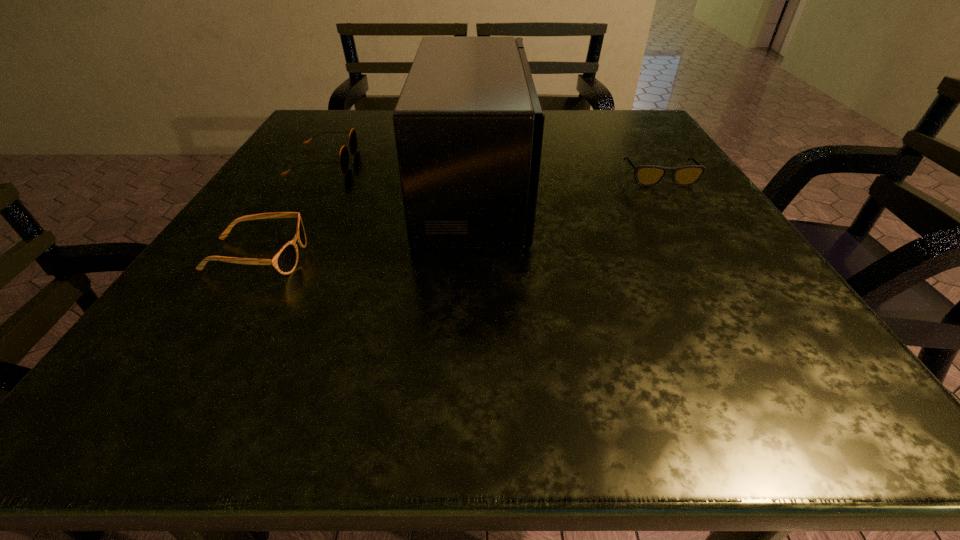
At what (x,y) coordinates should I click in order to perform the action: click on microwave_oven. Please return your answer as a coordinate pair (x, y). The width and height of the screenshot is (960, 540). Looking at the image, I should click on (468, 125).

You are a GUI agent. You are given a task and a screenshot of the screen. Output one action in this format:
    pyautogui.click(x=<x>, y=<y>)
    Task: Click on the tallest object
    Image resolution: width=960 pixels, height=540 pixels.
    Given the screenshot: What is the action you would take?
    pyautogui.click(x=468, y=125)

This screenshot has height=540, width=960. I want to click on the nearest sunglasses, so click(285, 261).

I want to click on the rightmost object, so click(645, 175).

Where is `free space located 0.330m on the front-facing side of the microwave_oven`? This screenshot has width=960, height=540. free space located 0.330m on the front-facing side of the microwave_oven is located at coordinates (698, 188).

Where is `free region located on the front-facing side of the nearest sunglasses`? Image resolution: width=960 pixels, height=540 pixels. free region located on the front-facing side of the nearest sunglasses is located at coordinates (367, 257).

Where is `vacant region located on the front-facing side of the rightmost sunglasses`? vacant region located on the front-facing side of the rightmost sunglasses is located at coordinates (703, 246).

What are the coordinates of `microwave_oven located at the far edge` in the screenshot? It's located at (468, 125).

Locate an element on the screen. The height and width of the screenshot is (540, 960). sunglasses that is at the far edge is located at coordinates (353, 144).

Find the location of `object present at the right edge`. object present at the right edge is located at coordinates (645, 175).